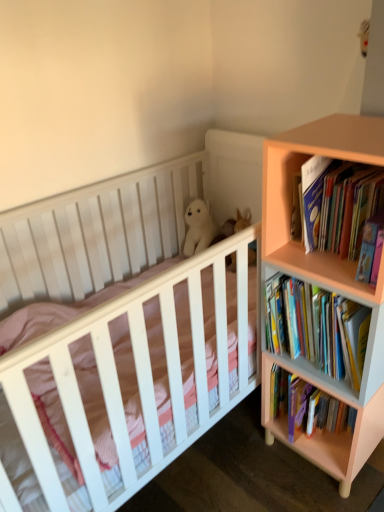
Question: Is white matte crib at center facing towards hardcover books at right, placed as the 1th book when sorted from bottom to top?

Choices:
 (A) yes
 (B) no

Answer: (A)

Question: Is white matte crib at center positioned before hardcover books at right, placed as the 1th book when sorted from bottom to top?

Choices:
 (A) yes
 (B) no

Answer: (A)

Question: From the image's perspective, is white matte crib at center below hardcover books at right, the second book from the top?

Choices:
 (A) yes
 (B) no

Answer: (A)

Question: Is white matte crib at center located outside hardcover books at right, the second book from the top?

Choices:
 (A) yes
 (B) no

Answer: (A)

Question: Are white matte crib at center and hardcover books at right, the second book from the top, located far from each other?

Choices:
 (A) no
 (B) yes

Answer: (A)

Question: Does white matte crib at center have a lesser width compared to hardcover books at right, placed as the 1th book when sorted from bottom to top?

Choices:
 (A) no
 (B) yes

Answer: (A)

Question: Does hardcover books at right, placed as the 1th book when sorted from bottom to top, turn towards white plush bear at center?

Choices:
 (A) no
 (B) yes

Answer: (A)

Question: Is hardcover books at right, the second book from the top, outside of white plush bear at center?

Choices:
 (A) yes
 (B) no

Answer: (A)

Question: Is hardcover books at right, the second book from the top, behind white plush bear at center?

Choices:
 (A) yes
 (B) no

Answer: (B)

Question: Can you confirm if hardcover books at right, the second book from the top, is smaller than white plush bear at center?

Choices:
 (A) no
 (B) yes

Answer: (A)

Question: From a real-world perspective, is hardcover books at right, the second book from the top, on top of white plush bear at center?

Choices:
 (A) yes
 (B) no

Answer: (A)

Question: Does hardcover books at right, placed as the 1th book when sorted from bottom to top, have a greater height compared to white plush bear at center?

Choices:
 (A) no
 (B) yes

Answer: (B)

Question: Can you confirm if white matte crib at center is taller than pink matte bookcase at right?

Choices:
 (A) yes
 (B) no

Answer: (B)